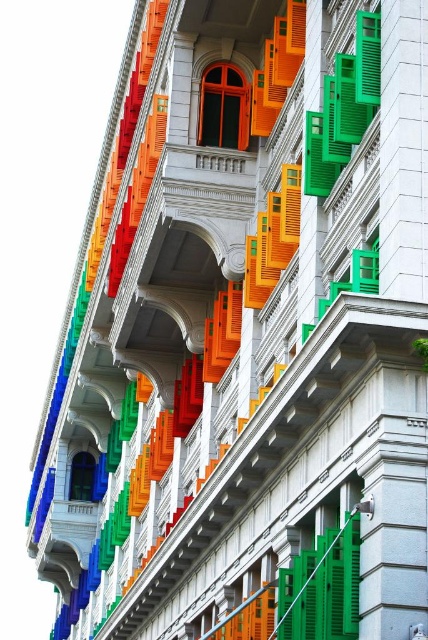
Between matte orange window at center and blue glass window at center, which one has less height?

blue glass window at center

Image resolution: width=428 pixels, height=640 pixels. What are the coordinates of `matte orange window at center` in the screenshot? It's located at (223, 108).

Image resolution: width=428 pixels, height=640 pixels. I want to click on matte orange window at center, so click(x=223, y=108).